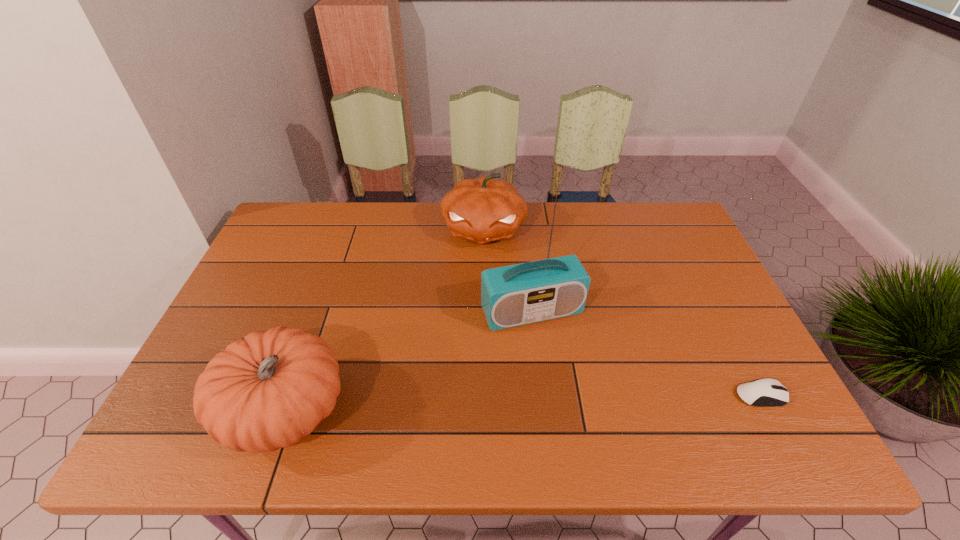
I want to click on vacant space that is in between the mouse and the nearer pumpkin, so click(523, 403).

Where is `free space between the radio receiver and the nearer pumpkin`? The height and width of the screenshot is (540, 960). free space between the radio receiver and the nearer pumpkin is located at coordinates (409, 362).

Where is `empty space between the mouse and the right pumpkin`? Image resolution: width=960 pixels, height=540 pixels. empty space between the mouse and the right pumpkin is located at coordinates (622, 312).

The width and height of the screenshot is (960, 540). Identify the location of vacant region between the nearer pumpkin and the tallest object. (409, 362).

Where is `free space between the third nearest object and the shortest object`? free space between the third nearest object and the shortest object is located at coordinates click(646, 354).

Where is `object that ranks as the second closest to the radio receiver`? This screenshot has width=960, height=540. object that ranks as the second closest to the radio receiver is located at coordinates (269, 389).

Identify which object is located as the nearest to the farthest object. Please provide its 2D coordinates. Your answer should be formatted as a tuple, i.e. [(x, y)], where the tuple contains the x and y coordinates of a point satisfying the conditions above.

[(525, 293)]

Where is `vacant area that satisfies the following two spatial constraints: 1. on the front side of the farther pumpkin; 2. on the right side of the mouse`? This screenshot has height=540, width=960. vacant area that satisfies the following two spatial constraints: 1. on the front side of the farther pumpkin; 2. on the right side of the mouse is located at coordinates (485, 395).

Identify the location of vacant area in the image that satisfies the following two spatial constraints: 1. on the back side of the nearer pumpkin; 2. on the right side of the right pumpkin. (349, 229).

Find the location of a particular element. The image size is (960, 540). vacant position in the image that satisfies the following two spatial constraints: 1. on the front side of the radio receiver; 2. on the right side of the rightmost object is located at coordinates (541, 395).